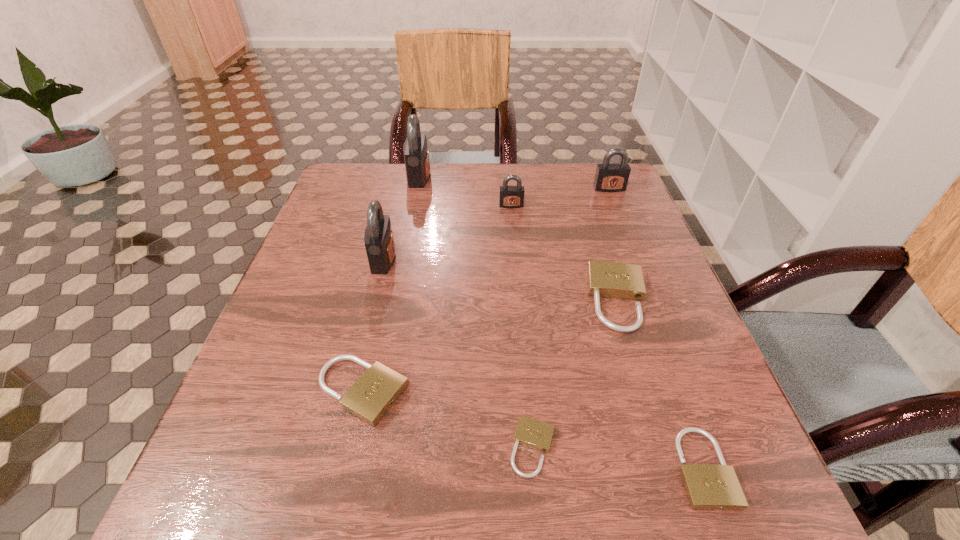
At what (x,y) coordinates should I click in order to perform the action: click on the third smallest beige padlock. Please return your answer as a coordinate pair (x, y). This screenshot has height=540, width=960. Looking at the image, I should click on (374, 393).

Find the location of `the leftmost beige padlock`. the leftmost beige padlock is located at coordinates (374, 393).

This screenshot has height=540, width=960. I want to click on the second shortest padlock, so (708, 486).

Where is `the second smallest beige padlock`? This screenshot has width=960, height=540. the second smallest beige padlock is located at coordinates (708, 486).

Where is `the shortest padlock`? The image size is (960, 540). the shortest padlock is located at coordinates (532, 433).

The width and height of the screenshot is (960, 540). I want to click on the second beige padlock from left to right, so click(532, 433).

What are the coordinates of `vacant area situated on the front of the biggest gray padlock near the keyhole` in the screenshot? It's located at (472, 177).

Identify the location of free location located on the front of the nearest gray padlock near the keyhole. The height and width of the screenshot is (540, 960). (444, 259).

You are a GUI agent. You are given a task and a screenshot of the screen. Output one action in this format:
    pyautogui.click(x=<x>, y=<y>)
    Task: Click on the vacant area situated 0.190m on the front of the sixth shortest padlock near the keyhole
    This screenshot has width=960, height=540.
    Given the screenshot: What is the action you would take?
    pyautogui.click(x=628, y=235)

The image size is (960, 540). In order to click on free region located 0.180m on the front of the sixth nearest padlock near the keyhole in this screenshot , I will do `click(516, 253)`.